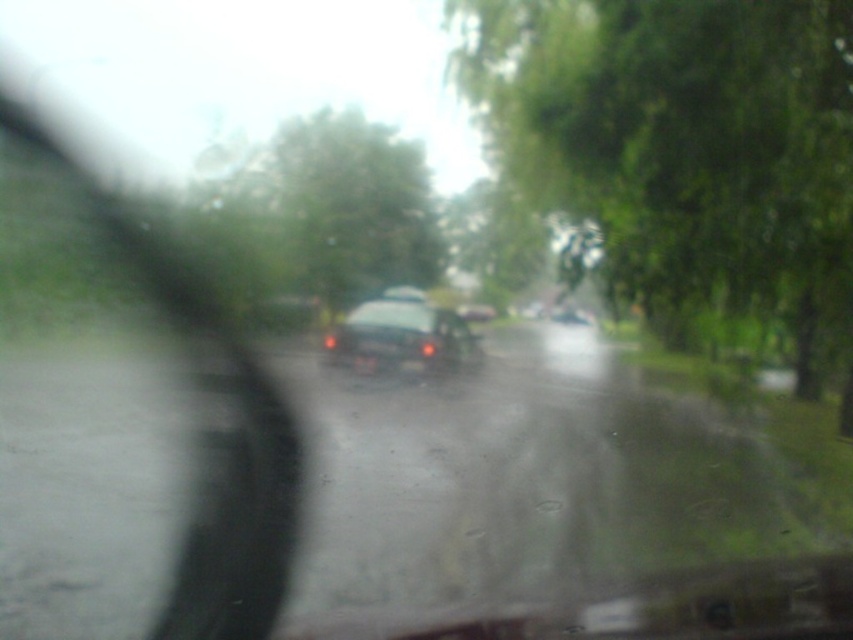
Between transparent plastic mirror at left and glossy black car at center, which one has less height?

glossy black car at center

How much distance is there between transparent plastic mirror at left and glossy black car at center?

transparent plastic mirror at left and glossy black car at center are 6.08 meters apart from each other.

The height and width of the screenshot is (640, 853). Find the location of `transparent plastic mirror at left`. transparent plastic mirror at left is located at coordinates click(x=213, y=442).

Find the location of `transparent plastic mirror at left`. transparent plastic mirror at left is located at coordinates (213, 442).

Does point (843, 358) come farther from viewer compared to point (451, 368)?

No.

Does green leafy tree at upper right come behind glossy black car at center?

That is False.

Does point (761, 148) come in front of point (363, 308)?

Yes, it is.

Image resolution: width=853 pixels, height=640 pixels. What are the coordinates of `green leafy tree at upper right` in the screenshot? It's located at (686, 152).

Where is `green leafy tree at upper right`? green leafy tree at upper right is located at coordinates (686, 152).

Which is more to the right, green leafy tree at upper right or transparent plastic mirror at left?

green leafy tree at upper right is more to the right.

Between point (846, 310) and point (260, 541), which one is positioned in front?

Point (260, 541) is more forward.

I want to click on green leafy tree at upper right, so click(686, 152).